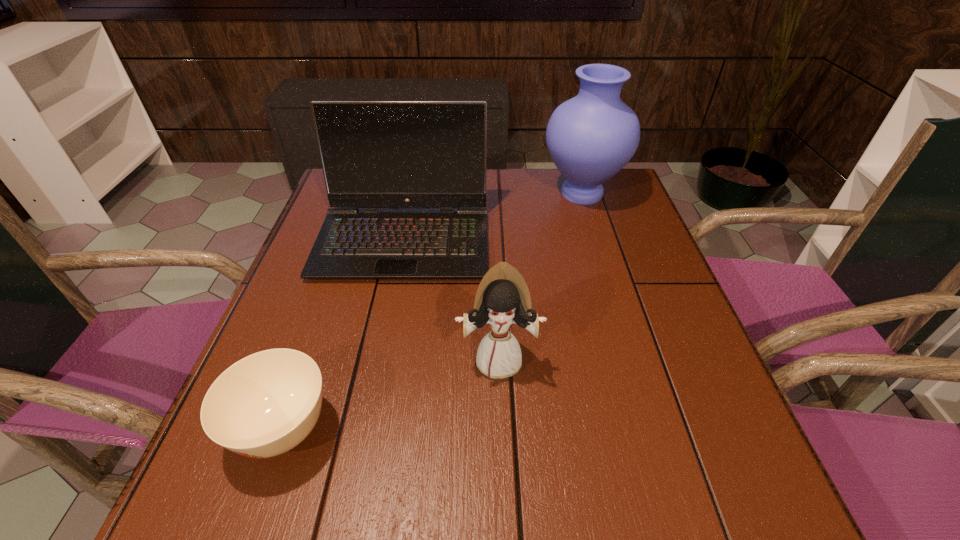
This screenshot has height=540, width=960. Identify the location of free spot at the left edge of the desktop. (346, 293).

The height and width of the screenshot is (540, 960). In the image, there is a desktop. What are the coordinates of `free space at the right edge` in the screenshot? It's located at (638, 312).

The width and height of the screenshot is (960, 540). In the image, there is a desktop. Find the location of `free space at the near left corner`. free space at the near left corner is located at coordinates (297, 509).

The image size is (960, 540). I want to click on vacant area at the far right corner, so [619, 197].

This screenshot has height=540, width=960. I want to click on blank region between the third shortest object and the rightmost object, so click(x=492, y=216).

You are a GUI agent. You are given a task and a screenshot of the screen. Output one action in this format:
    pyautogui.click(x=<x>, y=<y>)
    Task: Click on the vacant space in between the vase and the third shortest object
    This screenshot has height=540, width=960.
    Given the screenshot: What is the action you would take?
    pyautogui.click(x=492, y=216)

Where is `free point between the vase and the third shortest object`? This screenshot has height=540, width=960. free point between the vase and the third shortest object is located at coordinates (492, 216).

The image size is (960, 540). In order to click on empty space that is in between the doll and the laptop computer in this screenshot , I will do `click(451, 299)`.

Locate an element on the screen. The image size is (960, 540). free point between the doll and the nearest object is located at coordinates (391, 394).

This screenshot has width=960, height=540. I want to click on free space between the third shortest object and the shortest object, so click(344, 334).